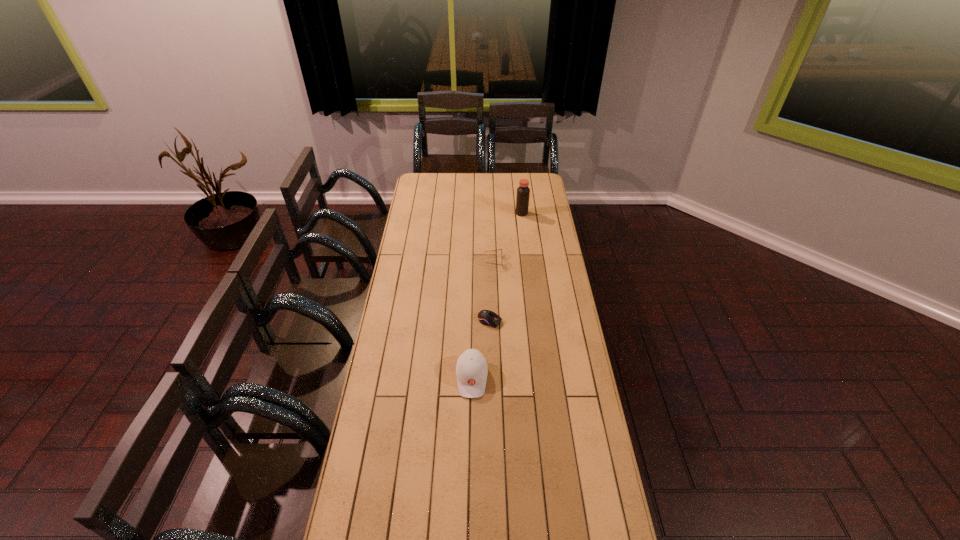
Find the location of a particular element. vacant area that lies between the third farthest object and the rightmost object is located at coordinates (506, 267).

Find the location of `unoccupied position between the farthest object and the spectacles`. unoccupied position between the farthest object and the spectacles is located at coordinates (508, 237).

Locate an element on the screen. The image size is (960, 540). object that stands as the second closest to the third farthest object is located at coordinates (498, 249).

Locate an element on the screen. The width and height of the screenshot is (960, 540). object that is the closest to the second nearest object is located at coordinates (471, 369).

Locate an element on the screen. The width and height of the screenshot is (960, 540). free spot that satisfies the following two spatial constraints: 1. on the front-facing side of the second farthest object; 2. on the front side of the second nearest object is located at coordinates (495, 321).

The image size is (960, 540). I want to click on vacant space that satisfies the following two spatial constraints: 1. on the front-facing side of the third nearest object; 2. on the front-facing side of the baseball cap, so click(498, 378).